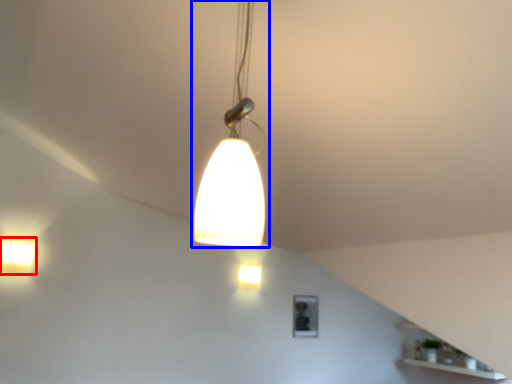
Question: Which point is further to the camera, lamp (highlighted by a red box) or lamp (highlighted by a blue box)?

Choices:
 (A) lamp
 (B) lamp

Answer: (A)